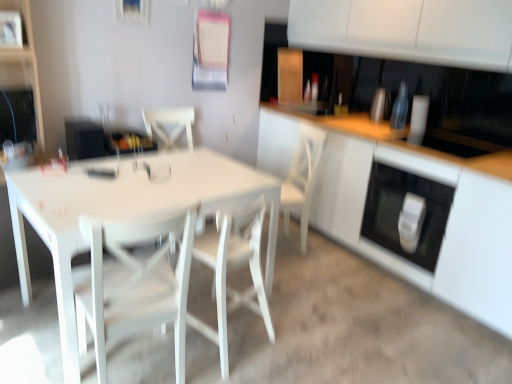
Identify the location of vacant area that is situated to the right of white wood chair at center, acting as the 2th chair starting from the left. (295, 321).